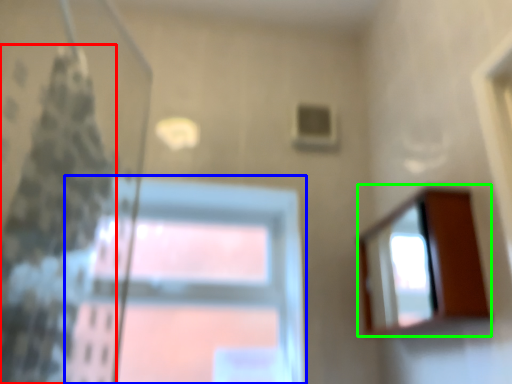
Question: Which object is positioned farthest from shower curtain (highlighted by a red box)? Select from window (highlighted by a blue box) and mirror (highlighted by a green box).

Choices:
 (A) window
 (B) mirror

Answer: (B)